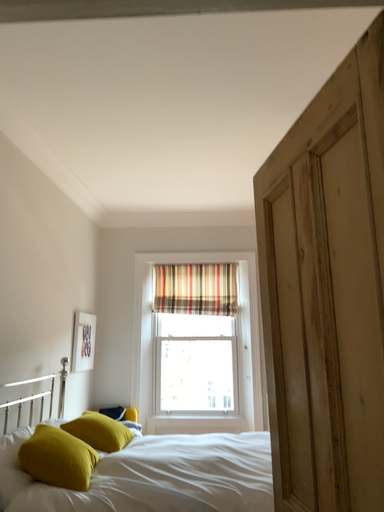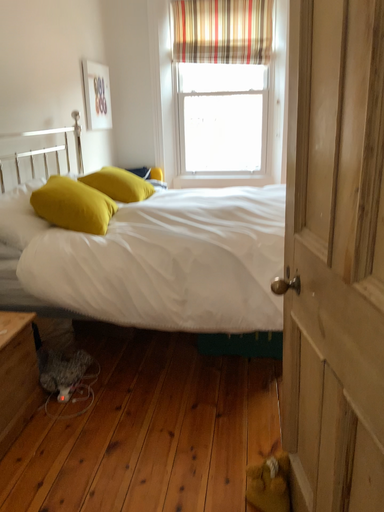
Question: Which way did the camera rotate in the video?

Choices:
 (A) rotated upward
 (B) rotated downward

Answer: (B)